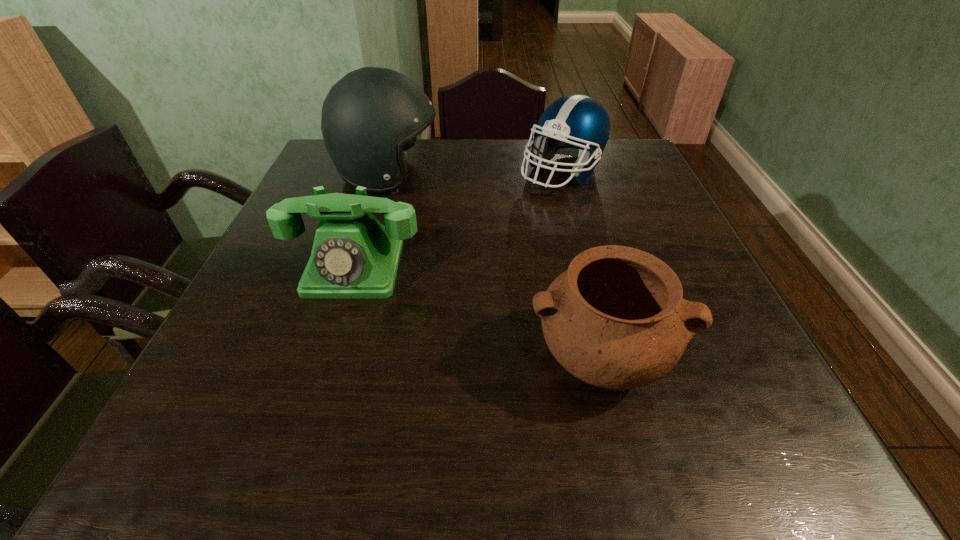
This screenshot has width=960, height=540. In order to click on vacant space at the far right corner in this screenshot , I will do `click(602, 158)`.

Where is `vacant area between the pottery and the taller football helmet`? vacant area between the pottery and the taller football helmet is located at coordinates (493, 267).

Where is `free space between the pottery and the taller football helmet`? Image resolution: width=960 pixels, height=540 pixels. free space between the pottery and the taller football helmet is located at coordinates (493, 267).

You are a GUI agent. You are given a task and a screenshot of the screen. Output one action in this format:
    pyautogui.click(x=<x>, y=<y>)
    Task: Click on the empty space that is in between the taller football helmet and the pottery
    
    Given the screenshot: What is the action you would take?
    pyautogui.click(x=493, y=267)

Find the location of a particular element. The height and width of the screenshot is (540, 960). blank region between the telephone and the shorter football helmet is located at coordinates (458, 220).

Where is `vacant space in between the right football helmet and the second nearest object`? Image resolution: width=960 pixels, height=540 pixels. vacant space in between the right football helmet and the second nearest object is located at coordinates (458, 220).

The height and width of the screenshot is (540, 960). In order to click on blank region between the shorter football helmet and the third farthest object in this screenshot , I will do click(x=458, y=220).

Locate an element on the screen. The height and width of the screenshot is (540, 960). free space between the left football helmet and the shorter football helmet is located at coordinates 475,174.

This screenshot has width=960, height=540. In order to click on object that is the closest one to the tallest object in this screenshot , I will do `click(353, 256)`.

Where is `object that ranks as the closest to the taller football helmet`? The image size is (960, 540). object that ranks as the closest to the taller football helmet is located at coordinates (353, 256).